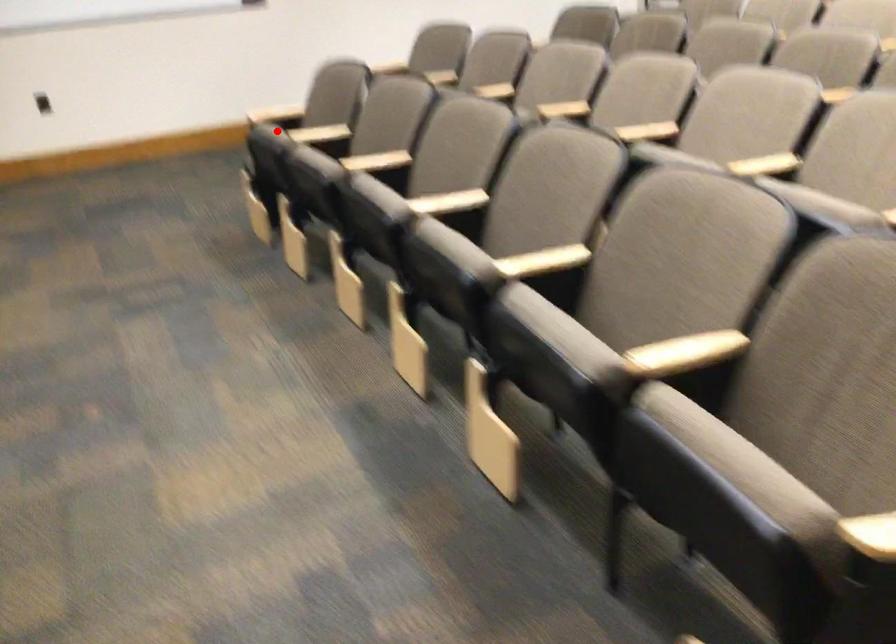
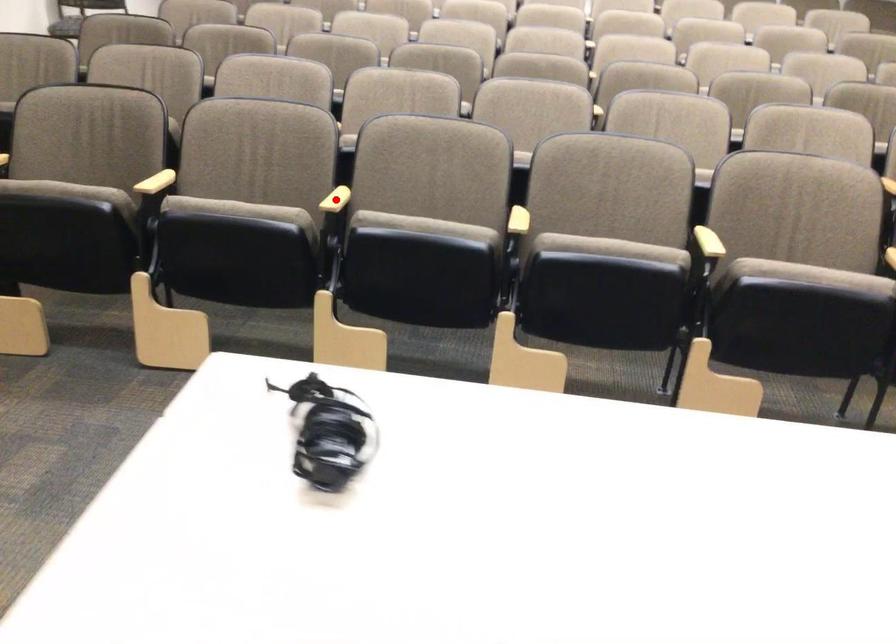
I am providing you with two images of the same scene from different viewpoints. A red point is marked on the first image and another point is marked on the second image. Does the point marked in image1 correspond to the same location as the one in image2?

No